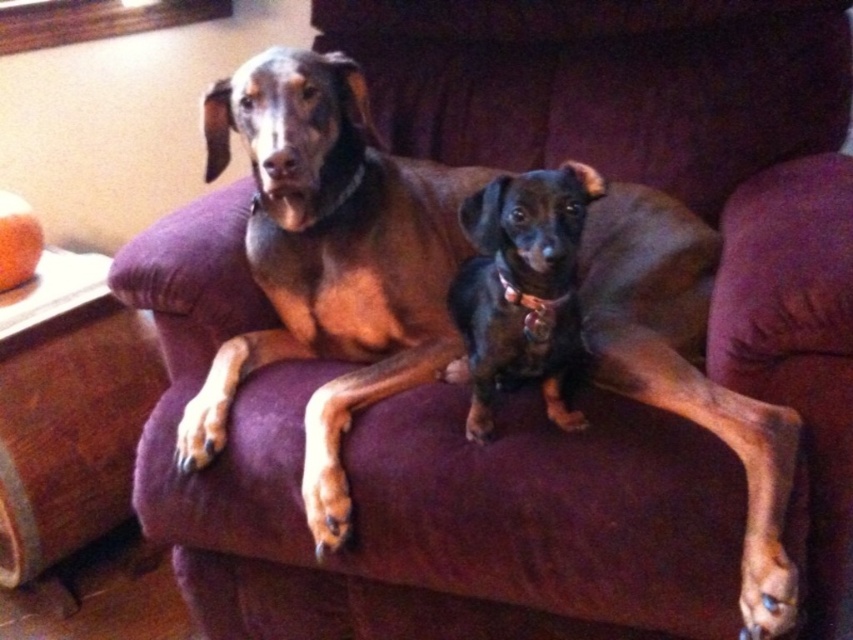
You are a dog trainer who needs to place a divider between two dogs to ensure they have enough space. The divider is 1 meter wide. Based on the image, will the divider fit between the brown smooth coat dog at center and the other dog?

The distance between the brown smooth coat dog at center and the other dog is 93.30 centimeters. Since the divider is 1 meter wide, which is 100 centimeters, the divider will not fit between them because the space is narrower than the divider.

You are a dog groomer who needs to choose the right size of grooming table for both dogs. The brown smooth coat dog at center and the black shiny dog at center are on the couch. Which dog requires a larger grooming table?

The brown smooth coat dog at center requires a larger grooming table because it is bigger than the black shiny dog at center according to the description.